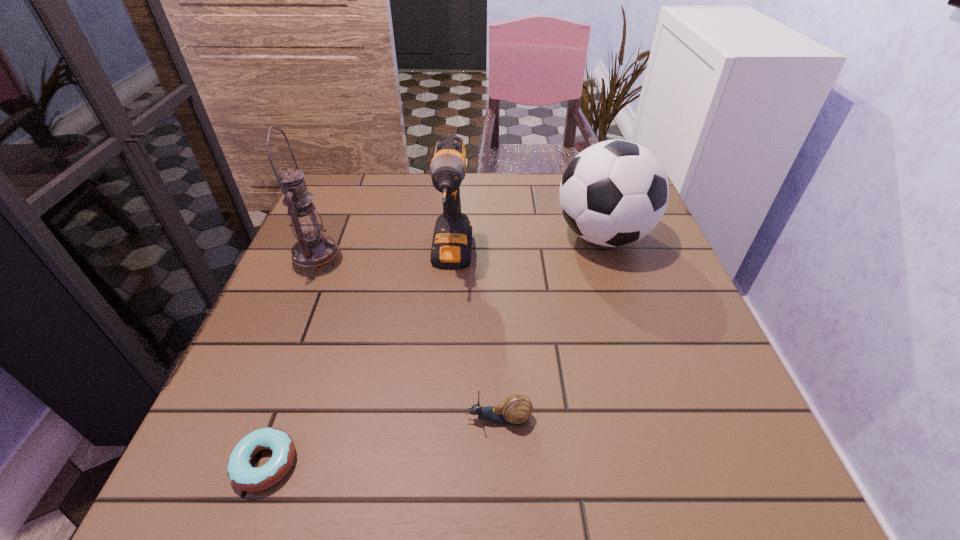
I want to click on free space located on the front-facing side of the second shortest object, so click(x=314, y=418).

At what (x,y) coordinates should I click in order to perform the action: click on vacant area situated 0.100m on the front-facing side of the second shortest object. Please return your answer as a coordinate pair (x, y). This screenshot has width=960, height=540. Looking at the image, I should click on (402, 418).

Identify the location of free space located 0.240m on the front-facing side of the second shortest object. (314, 418).

Where is `free spot located on the left of the nearest object`? The image size is (960, 540). free spot located on the left of the nearest object is located at coordinates (200, 463).

Where is `object that is at the far edge`? The height and width of the screenshot is (540, 960). object that is at the far edge is located at coordinates (613, 193).

The image size is (960, 540). Find the location of `object located in the near edge section of the desktop`. object located in the near edge section of the desktop is located at coordinates (242, 475).

Where is `oil lamp present at the left edge`? This screenshot has width=960, height=540. oil lamp present at the left edge is located at coordinates (314, 254).

You are a GUI agent. You are given a task and a screenshot of the screen. Output one action in this format:
    pyautogui.click(x=<x>, y=<y>)
    Task: Click on the doughnut that is at the left edge
    Image resolution: width=960 pixels, height=540 pixels.
    Given the screenshot: What is the action you would take?
    pyautogui.click(x=242, y=475)

Where is `object positioned at the right edge`? The height and width of the screenshot is (540, 960). object positioned at the right edge is located at coordinates (613, 193).

At what (x,y) coordinates should I click in order to perform the action: click on object that is at the near left corner. Please return your answer as a coordinate pair (x, y). Image resolution: width=960 pixels, height=540 pixels. Looking at the image, I should click on (242, 475).